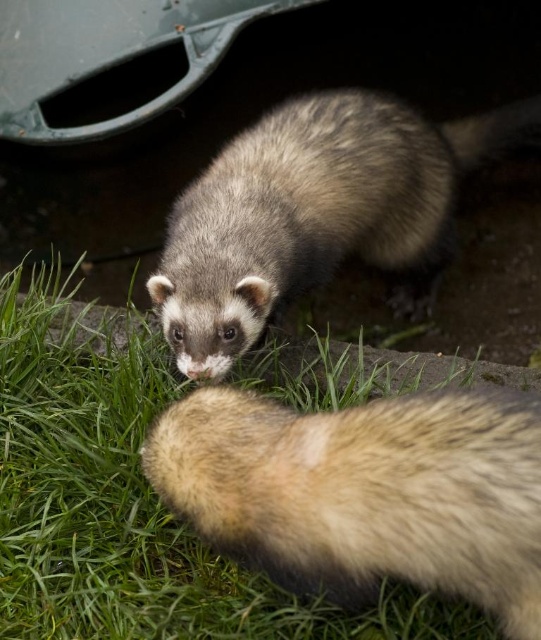
You are standing at the lower left corner of the image. You want to walk to the point marked at coordinates point (133,506). What direction should you head?

The point (133,506) is on green grass at lower left, so you are already at the lower left corner. You can stay where you are.

You are standing in the outdoor area where the two ferrets are. You notice a point marked at coordinates (133, 506). Based on the scene description, what is located at that point?

The point at coordinates (133, 506) marks green grass at lower left.

Looking at this image, you are observing two points in a coordinate system. The first point is at position point (62,493) and the second is at point (408,573). Based on their coordinates, which point is located behind the other?

Point (62,493) is behind point (408,573).